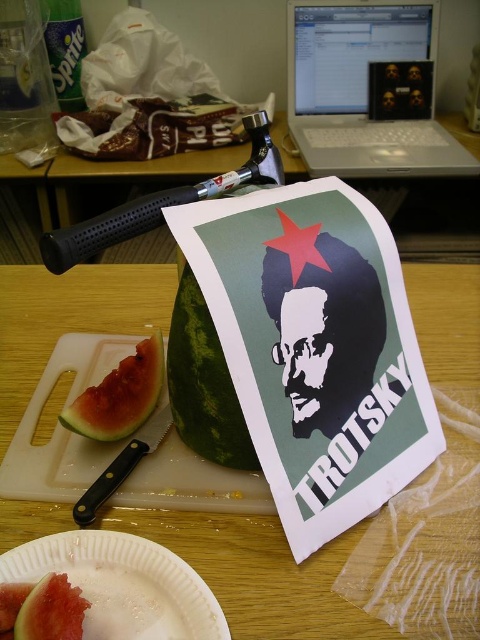
You are organizing the items on the wooden table at center and the red flesh watermelon at center. Which object is closer to you?

The wooden table at center is closer to you because it is in front of the red flesh watermelon at center.

You are organizing a picnic and need to know which item is larger to decide what to pack first. Based on the scene, which is bigger, the wooden table at center or the red flesh watermelon at center?

The wooden table at center is bigger than the red flesh watermelon at center, so you should pack the wooden table at center first.

You are organizing a picnic and need to choose the larger watermelon between the green textured melon at center and the green matte watermelon at lower left. Which one should you pick?

You should pick the green textured melon at center because its width is larger than the green matte watermelon at lower left.